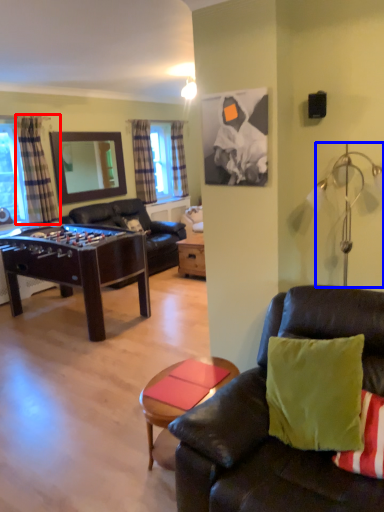
Question: Which object is further to the camera taking this photo, curtain (highlighted by a red box) or lamp (highlighted by a blue box)?

Choices:
 (A) curtain
 (B) lamp

Answer: (A)